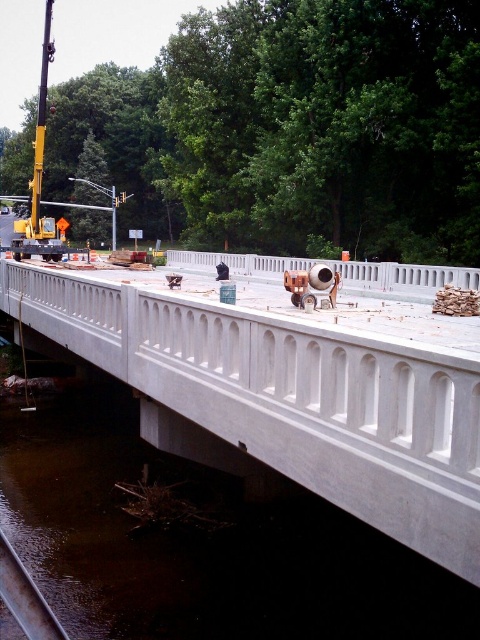
This screenshot has height=640, width=480. Find the location of `white concrete bridge at center`. white concrete bridge at center is located at coordinates (289, 397).